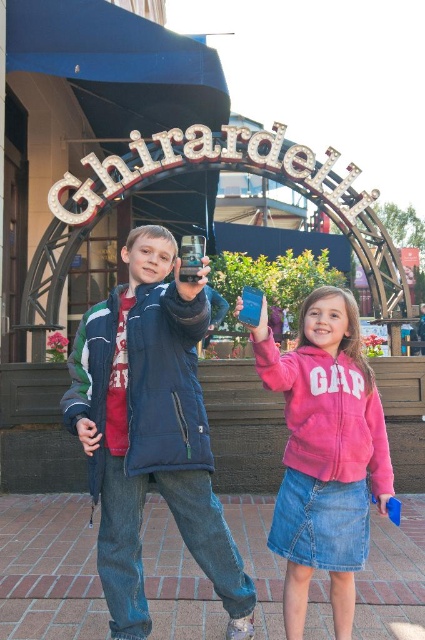
Consider the image. You are a photographer trying to capture the scene of two children in front of the Ghirardelli archway. You notice the matte blue jacket at center and the pink fleece jacket at center. Which jacket should you focus on to ensure it appears higher in your photo?

The matte blue jacket at center is above the pink fleece jacket at center, so focusing on the matte blue jacket at center will ensure it appears higher in the photo.

You are a photographer trying to capture both the matte blue jacket at center and the pink fleece jacket at center in one frame. Given that your camera has a fixed width, which jacket should you position closer to the camera to ensure both fit without cropping?

Since the matte blue jacket at center is wider than the pink fleece jacket at center, you should position the matte blue jacket at center closer to the camera to ensure both fit within the frame without cropping.